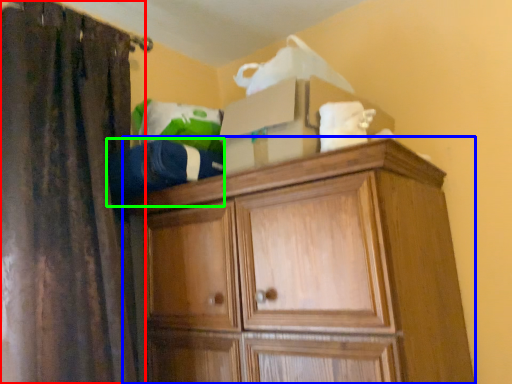
Question: Based on their relative distances, which object is farther from curtain (highlighted by a red box)? Choose from cupboard (highlighted by a blue box) and clothing (highlighted by a green box).

Choices:
 (A) cupboard
 (B) clothing

Answer: (A)